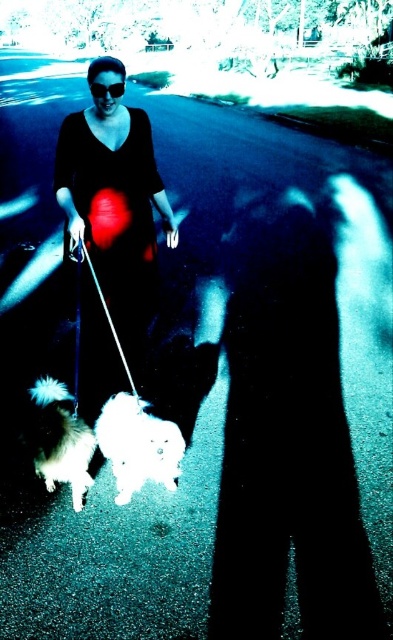
You are a photographer trying to capture the white fluffy dog at lower left and the black matte goggles at upper center in the same frame. Which object will appear larger in your photo?

The white fluffy dog at lower left will appear larger in the photo because it is bigger than the black matte goggles at upper center.

You are a photographer trying to capture a clear photo of the matte black dress at center and the white fluffy dog at lower left. You need to ensure both subjects are in focus. Given their distance apart, can you adjust your camera settings to achieve this?

The matte black dress at center and white fluffy dog at lower left are 3.68 feet apart. To capture both in focus, adjust your camera to a smaller aperture for a deeper depth of field, ensuring both subjects are within the sharpness range.

You are standing at the center of the image and want to locate the white fluffy dog at lower left. Based on the coordinates provided, in which direction should you look to find it?

The white fluffy dog at lower left is located at coordinates point (137, 445), which means you should look to the lower left direction to find it.